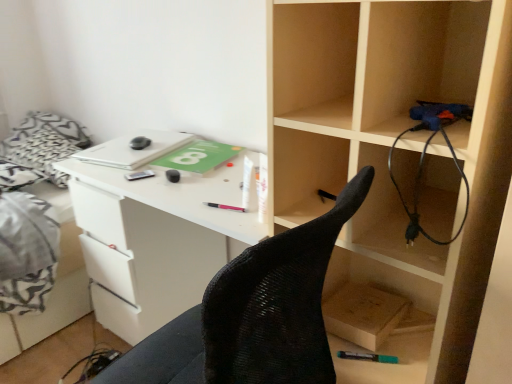
What do you see at coordinates (420, 185) in the screenshot?
I see `black rubber wire at right` at bounding box center [420, 185].

Find the location of a particular element. black rubber wire at right is located at coordinates (420, 185).

Measure the distance between point (229,206) and camera.

Point (229,206) is 3.68 feet from camera.

What do you see at coordinates (368, 357) in the screenshot? I see `teal matte marker at lower center, the first stationery from the right` at bounding box center [368, 357].

Describe the element at coordinates (60, 243) in the screenshot. The width and height of the screenshot is (512, 384). I see `white fabric bed at left` at that location.

Locate an element on the screen. This screenshot has width=512, height=384. black rubber wire at right is located at coordinates (420, 185).

Who is taller, black rubber wire at right or black mesh chair at center?

With more height is black mesh chair at center.

Measure the distance from black rubber wire at right to black mesh chair at center.

The distance of black rubber wire at right from black mesh chair at center is 9.29 inches.

Is black rubber wire at right positioned with its back to black mesh chair at center?

That's not correct — black rubber wire at right is not looking away from black mesh chair at center.

The width and height of the screenshot is (512, 384). Identify the location of wire above the black mesh chair at center (from a real-world perspective). (420, 185).

Does point (241, 208) come in front of point (316, 343)?

No, (241, 208) is further to viewer.

Is pink plastic pen at center, the second stationery viewed from the front, closer to camera compared to black mesh chair at center?

No, the depth of pink plastic pen at center, the second stationery viewed from the front, is greater than that of black mesh chair at center.

Does pink plastic pen at center, which appears as the 3th stationery when viewed from the top, touch black mesh chair at center?

No, pink plastic pen at center, which appears as the 3th stationery when viewed from the top, is not in contact with black mesh chair at center.

Does pink plastic pen at center, placed as the 3th stationery when sorted from back to front, turn towards black mesh chair at center?

Yes.

From the image's perspective, is teal matte marker at lower center, the 1th stationery ordered from the bottom, beneath black mesh chair at center?

Yes, from the image's perspective, teal matte marker at lower center, the 1th stationery ordered from the bottom, is below black mesh chair at center.

Are teal matte marker at lower center, the 1th stationery ordered from the bottom, and black mesh chair at center making contact?

No, teal matte marker at lower center, the 1th stationery ordered from the bottom, is not touching black mesh chair at center.

Considering the relative sizes of teal matte marker at lower center, the first stationery from the right, and black mesh chair at center in the image provided, is teal matte marker at lower center, the first stationery from the right, taller than black mesh chair at center?

No, teal matte marker at lower center, the first stationery from the right, is not taller than black mesh chair at center.

Considering the relative positions of black rubber wire at right and pink plastic pen at center, acting as the 2th stationery starting from the right, in the image provided, is black rubber wire at right to the left or to the right of pink plastic pen at center, acting as the 2th stationery starting from the right,?

black rubber wire at right is to the right of pink plastic pen at center, acting as the 2th stationery starting from the right.

Would you consider black rubber wire at right to be distant from pink plastic pen at center, which appears as the 3th stationery when viewed from the top?

No, black rubber wire at right is not far from pink plastic pen at center, which appears as the 3th stationery when viewed from the top.

Is black rubber wire at right oriented away from pink plastic pen at center, which appears as the 3th stationery when viewed from the top?

No, black rubber wire at right is not facing the opposite direction of pink plastic pen at center, which appears as the 3th stationery when viewed from the top.

Could you measure the distance between black rubber wire at right and pink plastic pen at center, acting as the 2th stationery starting from the bottom?

black rubber wire at right and pink plastic pen at center, acting as the 2th stationery starting from the bottom, are 18.48 inches apart.

From the image's perspective, is metallic silver pen at center, the fourth stationery when ordered from right to left, above or below wooden box at lower right?

Clearly, from the image's perspective, metallic silver pen at center, the fourth stationery when ordered from right to left, is above wooden box at lower right.

In the image, is metallic silver pen at center, which is the 2th stationery in top-to-bottom order, positioned in front of or behind wooden box at lower right?

metallic silver pen at center, which is the 2th stationery in top-to-bottom order, is behind wooden box at lower right.

Who is bigger, metallic silver pen at center, the fourth stationery when ordered from right to left, or wooden box at lower right?

With larger size is wooden box at lower right.

From a real-world perspective, which object stands above the other?

black rubber mouse at center, which ranks as the fourth stationery in bottom-to-top order, is physically above.

Considering the positions of points (170, 179) and (242, 210), is point (170, 179) farther from camera compared to point (242, 210)?

That is True.

From the image's perspective, is black rubber mouse at center, which is the 1th stationery from top to bottom, located above pink plastic pen at center, which appears as the 3th stationery when viewed from the top?

Yes, from the image's perspective, black rubber mouse at center, which is the 1th stationery from top to bottom, is above pink plastic pen at center, which appears as the 3th stationery when viewed from the top.

Looking at their sizes, would you say black rubber mouse at center, acting as the 3th stationery starting from the front, is wider or thinner than pink plastic pen at center, placed as the 3th stationery when sorted from back to front?

In the image, black rubber mouse at center, acting as the 3th stationery starting from the front, appears to be wider than pink plastic pen at center, placed as the 3th stationery when sorted from back to front.

Is point (124, 175) more distant than point (360, 357)?

Yes, point (124, 175) is farther from viewer.

Considering the positions of objects metallic silver pen at center, which is the 2th stationery in top-to-bottom order, and teal matte marker at lower center, which ranks as the first stationery in front-to-back order, in the image provided, who is more to the right, metallic silver pen at center, which is the 2th stationery in top-to-bottom order, or teal matte marker at lower center, which ranks as the first stationery in front-to-back order,?

teal matte marker at lower center, which ranks as the first stationery in front-to-back order, is more to the right.

In the scene shown: Is the depth of metallic silver pen at center, which is the 2th stationery in top-to-bottom order, greater than that of teal matte marker at lower center, the first stationery from the right?

Yes, the depth of metallic silver pen at center, which is the 2th stationery in top-to-bottom order, is greater than that of teal matte marker at lower center, the first stationery from the right.

Find the location of a particular element. chair below the black rubber wire at right (from a real-world perspective) is located at coordinates (253, 314).

Find the location of a particular element. This screenshot has height=384, width=512. chair that is below the pink plastic pen at center, which appears as the 3th stationery when viewed from the top (from the image's perspective) is located at coordinates (253, 314).

Which object lies nearer to the anchor point metallic silver pen at center, the fourth stationery when ordered from front to back, pink plastic pen at center, which appears as the 3th stationery when viewed from the top, or black mesh chair at center?

Among the two, pink plastic pen at center, which appears as the 3th stationery when viewed from the top, is located nearer to metallic silver pen at center, the fourth stationery when ordered from front to back.

From the image, which object appears to be nearer to black rubber wire at right, white fabric bed at left or black rubber mouse at center, which ranks as the second stationery in back-to-front order?

Among the two, black rubber mouse at center, which ranks as the second stationery in back-to-front order, is located nearer to black rubber wire at right.

Which object lies further to the anchor point metallic silver pen at center, the fourth stationery when ordered from right to left, wooden box at lower right or teal matte marker at lower center, the fourth stationery positioned from the back?

Among the two, teal matte marker at lower center, the fourth stationery positioned from the back, is located further to metallic silver pen at center, the fourth stationery when ordered from right to left.

From the image, which object appears to be farther from black rubber mouse at center, which is counted as the 2th stationery, starting from the left, black mesh chair at center or pink plastic pen at center, which appears as the 3th stationery when viewed from the top?

black mesh chair at center is positioned further to the anchor black rubber mouse at center, which is counted as the 2th stationery, starting from the left.

When comparing their distances from pink plastic pen at center, the third stationery viewed from the left, does black mesh chair at center or metallic silver pen at center, the fourth stationery when ordered from right to left, seem further?

Among the two, black mesh chair at center is located further to pink plastic pen at center, the third stationery viewed from the left.

Which object lies nearer to the anchor point pink plastic pen at center, the second stationery viewed from the front, black rubber mouse at center, which ranks as the fourth stationery in bottom-to-top order, or white fabric bed at left?

black rubber mouse at center, which ranks as the fourth stationery in bottom-to-top order, is closer to pink plastic pen at center, the second stationery viewed from the front.

Which object lies further to the anchor point black rubber mouse at center, the third stationery positioned from the right, pink plastic pen at center, placed as the 3th stationery when sorted from back to front, or wooden box at lower right?

wooden box at lower right lies further to black rubber mouse at center, the third stationery positioned from the right, than the other object.

Which object lies nearer to the anchor point metallic silver pen at center, the fourth stationery when ordered from right to left, teal matte marker at lower center, which ranks as the first stationery in front-to-back order, or black mesh chair at center?

teal matte marker at lower center, which ranks as the first stationery in front-to-back order, lies closer to metallic silver pen at center, the fourth stationery when ordered from right to left, than the other object.

The image size is (512, 384). I want to click on stationery between black rubber mouse at center, acting as the 3th stationery starting from the front, and teal matte marker at lower center, the fourth stationery positioned from the back, in the horizontal direction, so click(225, 207).

You are a GUI agent. You are given a task and a screenshot of the screen. Output one action in this format:
    pyautogui.click(x=<x>, y=<y>)
    Task: Click on the stationery between pink plastic pen at center, the third stationery viewed from the left, and wooden box at lower right from left to right
    This screenshot has height=384, width=512.
    Given the screenshot: What is the action you would take?
    pyautogui.click(x=368, y=357)

Where is `stationery between white fabric bed at left and black rubber mouse at center, which ranks as the second stationery in back-to-front order`? The width and height of the screenshot is (512, 384). stationery between white fabric bed at left and black rubber mouse at center, which ranks as the second stationery in back-to-front order is located at coordinates (139, 175).

This screenshot has width=512, height=384. What are the coordinates of `chair between white fabric bed at left and pink plastic pen at center, acting as the 2th stationery starting from the right` in the screenshot? It's located at (253, 314).